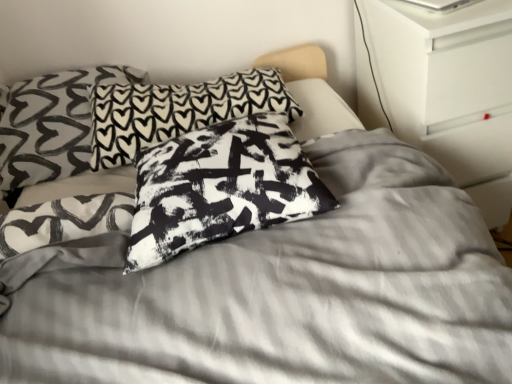
Question: From the image's perspective, is black-and-white printed pillow at center, the 1th pillow positioned from the front, positioned above or below black and white printed pillow at center, positioned as the 2th pillow in back-to-front order?

Choices:
 (A) above
 (B) below

Answer: (B)

Question: Visually, is black-and-white printed pillow at center, the third pillow in the back-to-front sequence, positioned to the left or to the right of black and white printed pillow at center, acting as the second pillow starting from the front?

Choices:
 (A) left
 (B) right

Answer: (B)

Question: Based on their relative distances, which object is nearer to the black-and-white printed pillow at center, the third pillow in the back-to-front sequence?

Choices:
 (A) white glossy dresser at upper right
 (B) black printed pillow at center, which is counted as the 1th pillow, starting from the back
 (C) black and white printed pillow at center, positioned as the 2th pillow in back-to-front order

Answer: (B)

Question: Considering the real-world distances, which object is farthest from the white glossy dresser at upper right?

Choices:
 (A) black-and-white printed pillow at center, the 1th pillow positioned from the front
 (B) black printed pillow at center, which is counted as the 1th pillow, starting from the back
 (C) black and white printed pillow at center, acting as the second pillow starting from the front

Answer: (C)